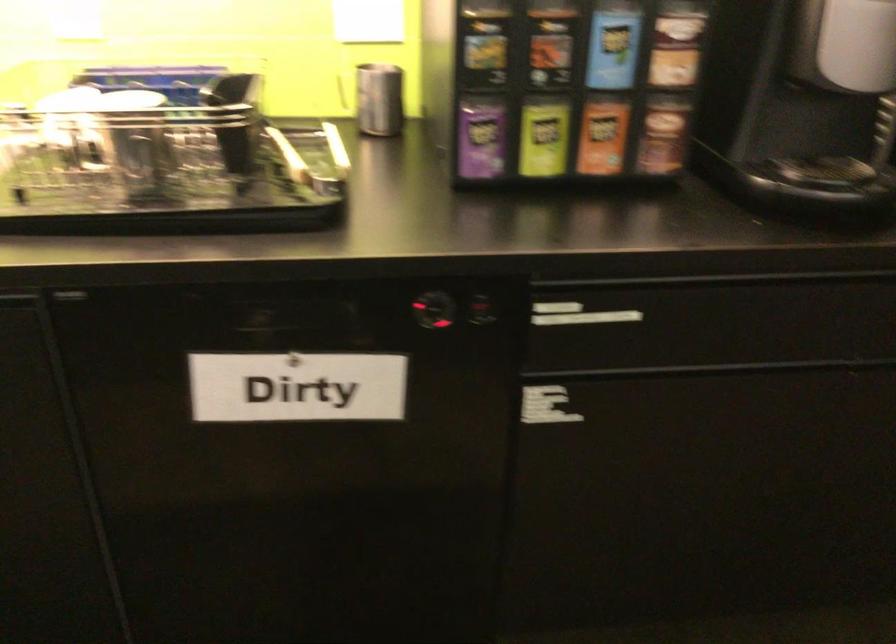
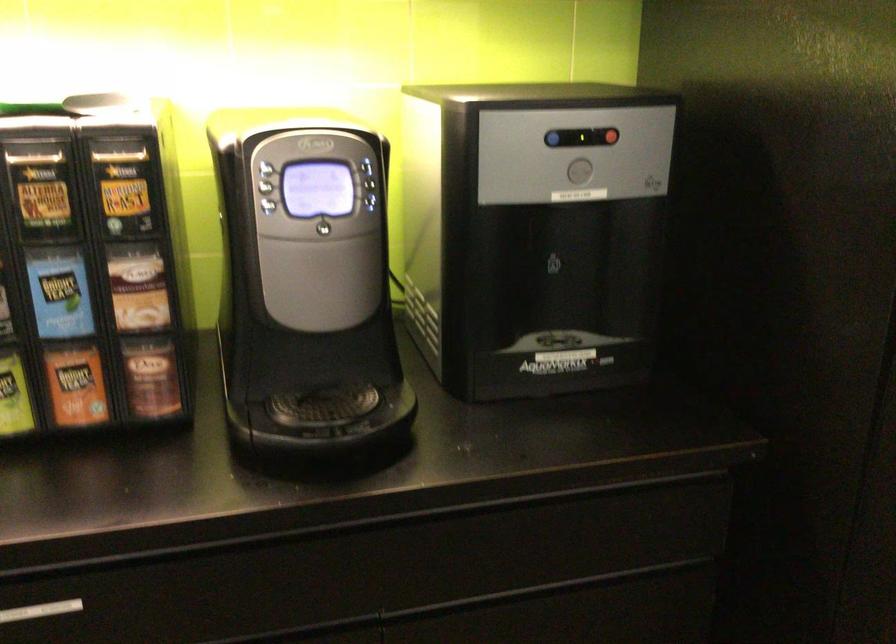
Where in the second image is the point corresponding to the point at 602,319 from the first image?

(40, 611)